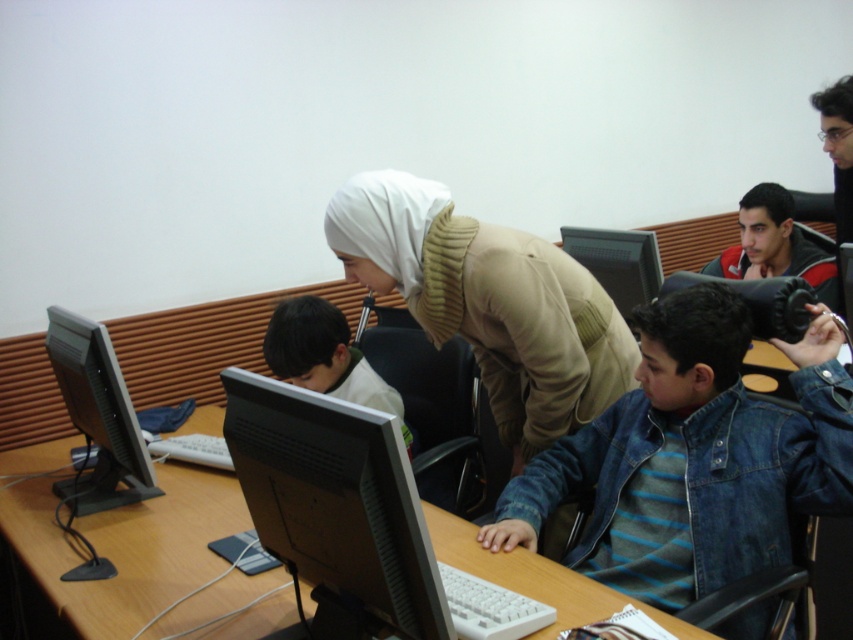
Which is above, denim jacket at lower right or black glossy monitor at left?

black glossy monitor at left is above.

Is point (720, 410) behind point (64, 400)?

No.

Describe the element at coordinates (694, 458) in the screenshot. I see `denim jacket at lower right` at that location.

You are a GUI agent. You are given a task and a screenshot of the screen. Output one action in this format:
    pyautogui.click(x=<x>, y=<y>)
    Task: Click on the denim jacket at lower right
    The image size is (853, 640).
    Given the screenshot: What is the action you would take?
    pyautogui.click(x=694, y=458)

Which of these two, black glossy monitor at left or dark blue denim jacket at upper right, stands taller?

Standing taller between the two is black glossy monitor at left.

Does black glossy monitor at left have a greater height compared to dark blue denim jacket at upper right?

Yes, black glossy monitor at left is taller than dark blue denim jacket at upper right.

Is point (57, 358) more distant than point (758, 244)?

No, it is not.

Image resolution: width=853 pixels, height=640 pixels. Identify the location of black glossy monitor at left. (97, 413).

Between dark blue denim jacket at upper right and matte black monitor at upper center, which one has less height?

matte black monitor at upper center is shorter.

What do you see at coordinates (776, 244) in the screenshot? The image size is (853, 640). I see `dark blue denim jacket at upper right` at bounding box center [776, 244].

The height and width of the screenshot is (640, 853). Identify the location of dark blue denim jacket at upper right. click(776, 244).